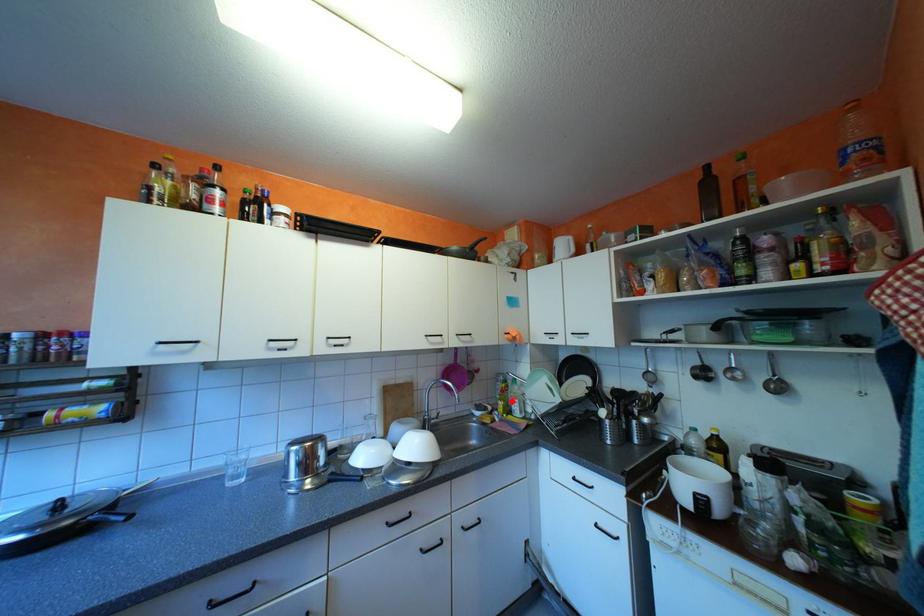
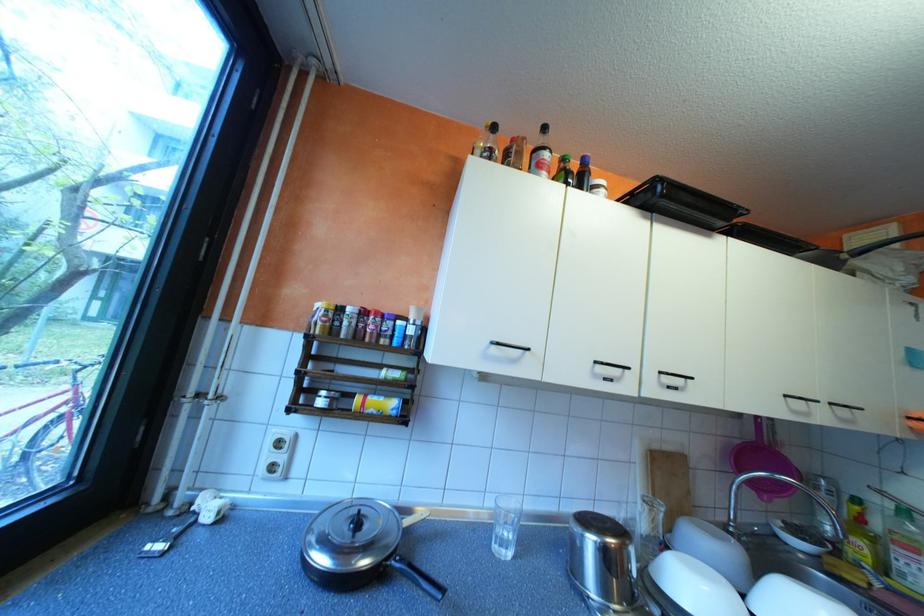
Where in the second image is the point corresponding to the highlighted location from the first image?

(871, 541)